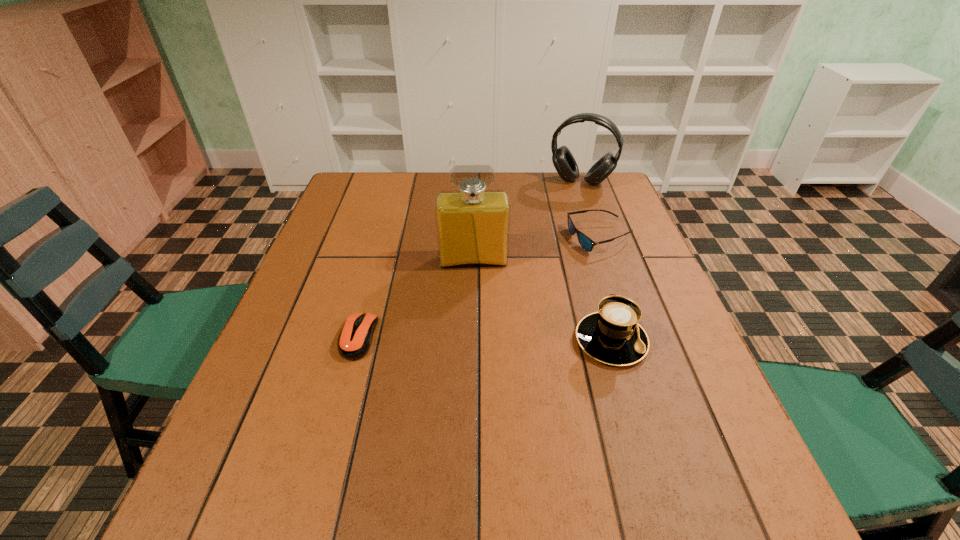
This screenshot has width=960, height=540. Identify the location of free space that is in between the sunglasses and the leftmost object. (479, 288).

The width and height of the screenshot is (960, 540). Identify the location of vacant space in between the second shortest object and the third tallest object. (606, 289).

The height and width of the screenshot is (540, 960). What are the coordinates of `free space between the fourth tallest object and the third shortest object` in the screenshot? It's located at (606, 289).

Locate an element on the screen. free area in between the fourth shortest object and the cappuccino is located at coordinates (596, 261).

Where is `free space between the sunglasses and the computer mouse`? free space between the sunglasses and the computer mouse is located at coordinates (479, 288).

Image resolution: width=960 pixels, height=540 pixels. I want to click on vacant area between the cappuccino and the farthest object, so click(596, 261).

At what (x,y) coordinates should I click in order to perform the action: click on vacant area that lies between the fourth tallest object and the perfume. Please return your answer as a coordinate pair (x, y). Looking at the image, I should click on (537, 249).

Locate an element on the screen. free space between the cappuccino and the fourth tallest object is located at coordinates (606, 289).

Identify the location of object that is the fourth closest one to the second shortest object. The width and height of the screenshot is (960, 540). (355, 339).

The image size is (960, 540). What are the coordinates of `the closest object relative to the leftmost object` in the screenshot? It's located at (473, 224).